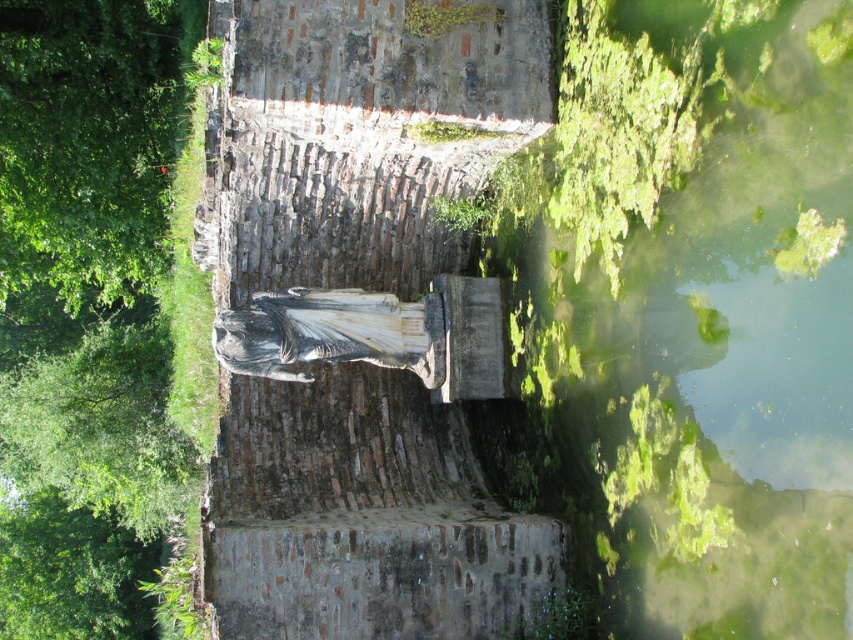
Between point (538, 314) and point (395, 596), which one is positioned behind?

Positioned behind is point (538, 314).

Is green algae water at lower right smaller than green mossy stone statue at center?

Actually, green algae water at lower right might be larger than green mossy stone statue at center.

Describe the element at coordinates (689, 316) in the screenshot. This screenshot has width=853, height=640. I see `green algae water at lower right` at that location.

Locate an element on the screen. The height and width of the screenshot is (640, 853). green algae water at lower right is located at coordinates (689, 316).

Is point (809, 484) behind point (96, 412)?

No, it is not.

Does green algae water at lower right appear over green leafy tree at upper left?

Yes, green algae water at lower right is above green leafy tree at upper left.

You are a GUI agent. You are given a task and a screenshot of the screen. Output one action in this format:
    pyautogui.click(x=<x>, y=<y>)
    Task: Click on the green algae water at lower right
    The width and height of the screenshot is (853, 640).
    Given the screenshot: What is the action you would take?
    pyautogui.click(x=689, y=316)

Who is more distant from viewer, (505, 524) or (88, 416)?

The point (88, 416) is more distant.

Between green mossy stone statue at center and green leafy tree at upper left, which one has less height?

green mossy stone statue at center

Where is `green mossy stone statue at center`? This screenshot has height=640, width=853. green mossy stone statue at center is located at coordinates (357, 321).

Identify the location of green mossy stone statue at center. (357, 321).